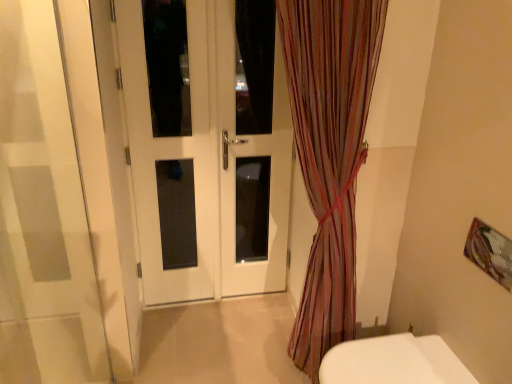
Question: In the image, is metallic silver picture frame at upper right positioned in front of or behind striped sheer curtain at center?

Choices:
 (A) behind
 (B) front

Answer: (A)

Question: Is metallic silver picture frame at upper right bigger or smaller than striped sheer curtain at center?

Choices:
 (A) big
 (B) small

Answer: (B)

Question: Estimate the real-world distances between objects in this image. Which object is farther from the striped sheer curtain at center?

Choices:
 (A) white glossy door at center
 (B) white glossy toilet at lower right
 (C) white glass door at center
 (D) metallic silver picture frame at upper right

Answer: (D)

Question: Which of these objects is positioned closest to the white glossy door at center?

Choices:
 (A) white glossy toilet at lower right
 (B) white glass door at center
 (C) metallic silver picture frame at upper right
 (D) striped sheer curtain at center

Answer: (B)